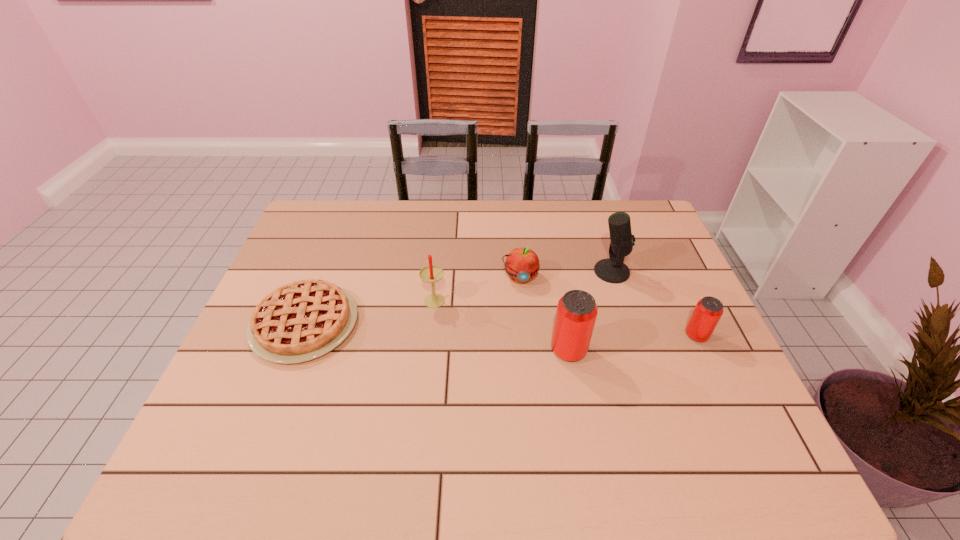
Please point out where to position a new can on the left to maintain spacing. Please provide its 2D coordinates. Your answer should be formatted as a tuple, i.e. [(x, y)], where the tuple contains the x and y coordinates of a point satisfying the conditions above.

[(432, 367)]